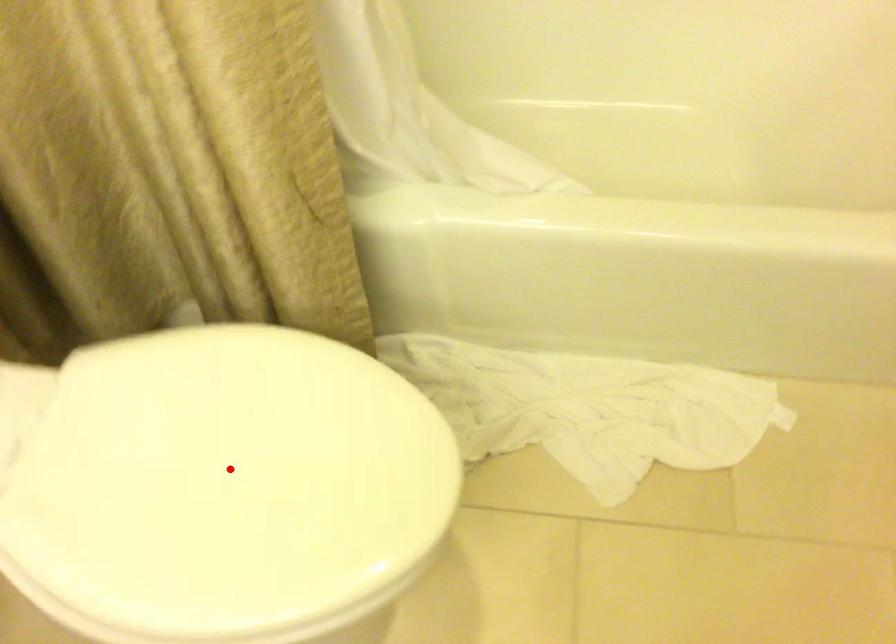
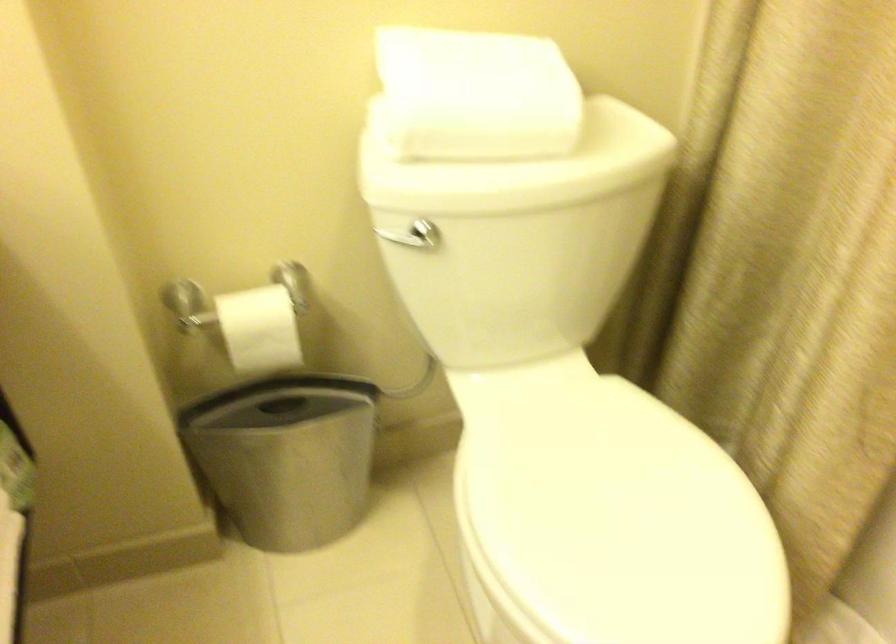
Find the pixel in the second image that matches the highlighted location in the first image.

(613, 518)